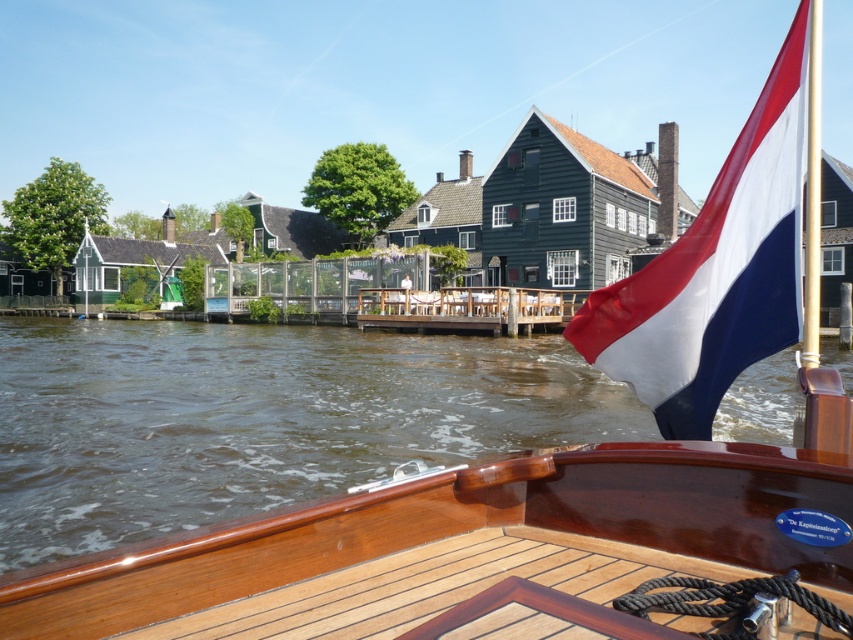
You are standing on the deck of the boat and want to compare the width of the brown water at center and the polished wood flagpole at upper right. Which one is wider?

The brown water at center is wider than the polished wood flagpole at upper right according to the description.